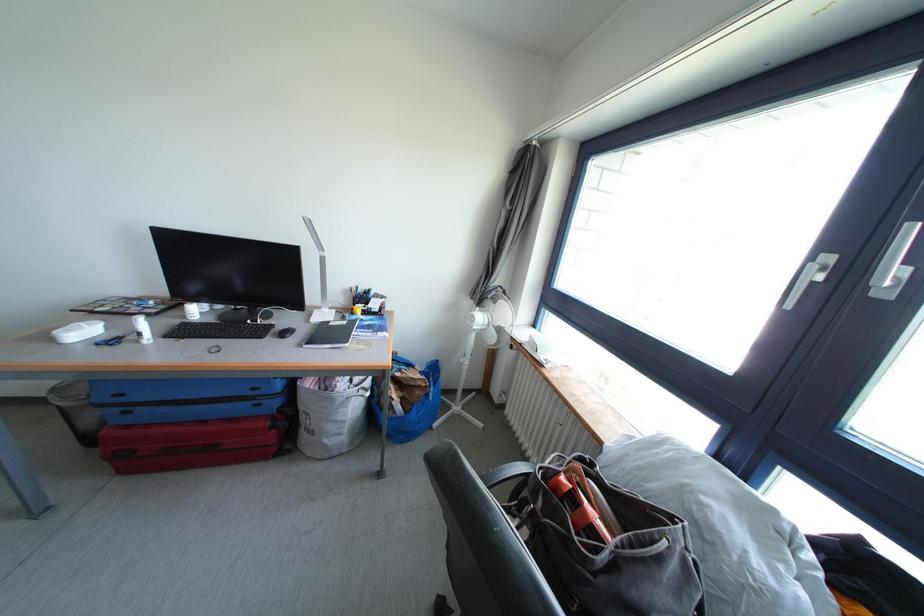
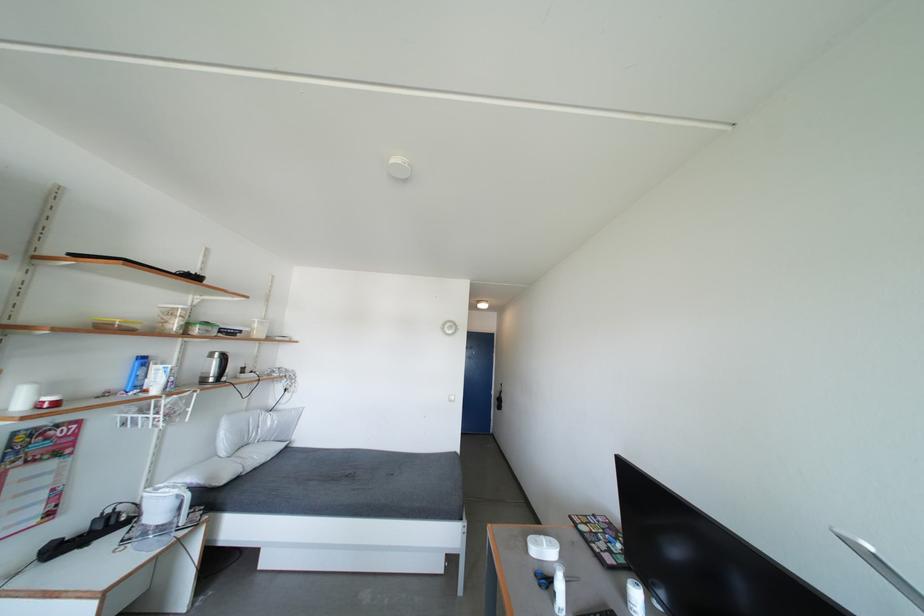
Question: The camera is either moving clockwise (left) or counter-clockwise (right) around the object. The first image is from the beginning of the video and the second image is from the end. Is the camera moving left or right when shooting the video?

Choices:
 (A) Left
 (B) Right

Answer: (B)